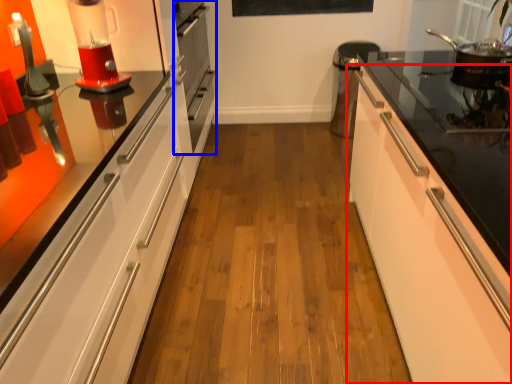
Question: Which point is further to the camera, cabinetry (highlighted by a red box) or oven (highlighted by a blue box)?

Choices:
 (A) cabinetry
 (B) oven

Answer: (B)